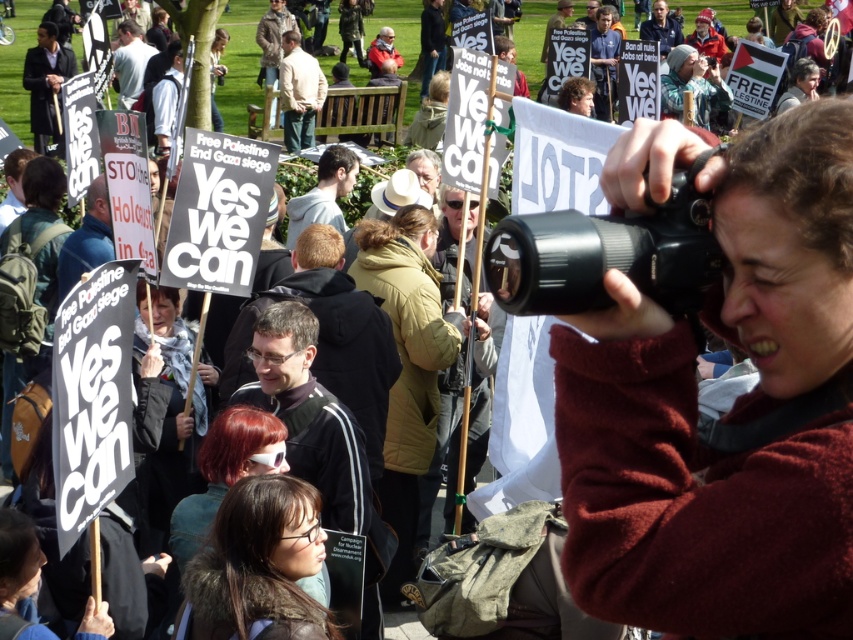
In the scene shown: You are a photographer at the protest and want to capture a photo of both the maroon fleece at center and the dark brown hair at center in the same frame. Which object should you focus on first to ensure both are in focus?

The maroon fleece at center is closer to the viewer than dark brown hair at center. To ensure both are in focus, focus on the maroon fleece at center first since it is closer, and the dark brown hair at center will be within the depth of field.

You are a photographer standing in the park and want to take a photo of the protest. You notice two points in the scene labeled as point [584,531] and point [196,572]. Which point is closer to you?

Point [584,531] is closer to the viewer than point [196,572].

You are a photographer standing at the center of the protest scene. You want to take a photo that includes both the point at coordinates point (654, 284) and point (210, 634). Which point will appear larger in your photo?

Point (654, 284) is closer to the camera than point (210, 634), so it will appear larger in the photo.